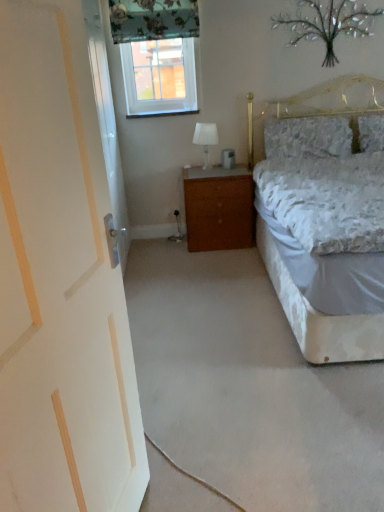
Locate an element on the screen. The image size is (384, 512). free space that is to the left of wooden nightstand at center is located at coordinates (163, 245).